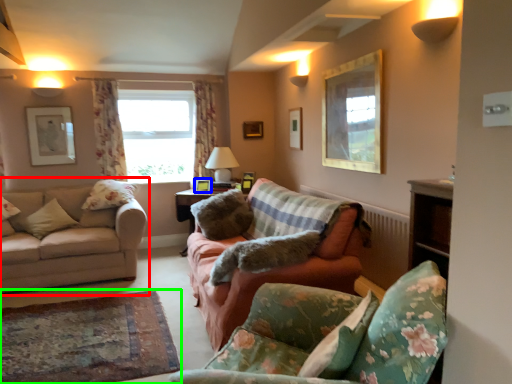
Question: Estimate the real-world distances between objects in this image. Which object is farther from studio couch (highlighted by a red box), picture frame (highlighted by a blue box) or plain (highlighted by a green box)?

Choices:
 (A) picture frame
 (B) plain

Answer: (A)